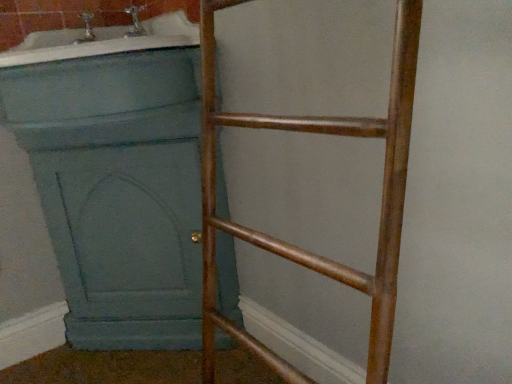
Locate an element on the screen. The width and height of the screenshot is (512, 384). bronze metallic ladder at right is located at coordinates (293, 245).

Where is `matte blue bathtub at upper left`? matte blue bathtub at upper left is located at coordinates (103, 41).

At what (x,y) coordinates should I click in order to perform the action: click on bronze metallic ladder at right. Please return your answer as a coordinate pair (x, y). The width and height of the screenshot is (512, 384). Looking at the image, I should click on coord(293,245).

Is teal painted wood screen door at left far away from matte blue bathtub at upper left?

They are positioned close to each other.

Is teal painted wood screen door at left located outside matte blue bathtub at upper left?

teal painted wood screen door at left lies outside matte blue bathtub at upper left's area.

In order to click on screen door to the right of matte blue bathtub at upper left in this screenshot , I will do `click(126, 242)`.

Measure the distance from teal painted wood screen door at left to matte blue bathtub at upper left.

teal painted wood screen door at left is 15.96 inches away from matte blue bathtub at upper left.

Can you confirm if bronze metallic ladder at right is wider than teal painted wood screen door at left?

In fact, bronze metallic ladder at right might be narrower than teal painted wood screen door at left.

Considering the relative positions of bronze metallic ladder at right and teal painted wood screen door at left in the image provided, is bronze metallic ladder at right to the left or to the right of teal painted wood screen door at left?

bronze metallic ladder at right is positioned on teal painted wood screen door at left's right side.

In the image, is bronze metallic ladder at right positioned in front of or behind teal painted wood screen door at left?

bronze metallic ladder at right is in front of teal painted wood screen door at left.

Consider the image. Is bronze metallic ladder at right positioned with its back to teal painted wood screen door at left?

No, bronze metallic ladder at right is not facing away from teal painted wood screen door at left.

In terms of size, does bronze metallic ladder at right appear bigger or smaller than matte blue bathtub at upper left?

Clearly, bronze metallic ladder at right is larger in size than matte blue bathtub at upper left.

Is bronze metallic ladder at right to the right of matte blue bathtub at upper left from the viewer's perspective?

Correct, you'll find bronze metallic ladder at right to the right of matte blue bathtub at upper left.

Is there a large distance between bronze metallic ladder at right and matte blue bathtub at upper left?

They are positioned close to each other.

From a real-world perspective, is bronze metallic ladder at right below matte blue bathtub at upper left?

Yes, from a real-world perspective, bronze metallic ladder at right is beneath matte blue bathtub at upper left.

From the image's perspective, between matte blue bathtub at upper left and bronze metallic ladder at right, who is located below?

bronze metallic ladder at right, from the image's perspective.

From a real-world perspective, is matte blue bathtub at upper left under bronze metallic ladder at right?

No, from a real-world perspective, matte blue bathtub at upper left is not below bronze metallic ladder at right.

Is matte blue bathtub at upper left not inside bronze metallic ladder at right?

matte blue bathtub at upper left lies outside bronze metallic ladder at right's area.

Which point is more distant from viewer, (48, 42) or (204, 244)?

The point (48, 42) is farther.

Considering the relative positions of matte blue bathtub at upper left and teal painted wood screen door at left in the image provided, is matte blue bathtub at upper left to the left of teal painted wood screen door at left from the viewer's perspective?

Correct, you'll find matte blue bathtub at upper left to the left of teal painted wood screen door at left.

Is matte blue bathtub at upper left thinner than teal painted wood screen door at left?

Incorrect, the width of matte blue bathtub at upper left is not less than that of teal painted wood screen door at left.

Are matte blue bathtub at upper left and teal painted wood screen door at left making contact?

There is a gap between matte blue bathtub at upper left and teal painted wood screen door at left.

Which object is closer to the camera, matte blue bathtub at upper left or teal painted wood screen door at left?

matte blue bathtub at upper left is more forward.

How distant is teal painted wood screen door at left from bronze metallic ladder at right?

teal painted wood screen door at left is 39.16 centimeters from bronze metallic ladder at right.

Considering the sizes of teal painted wood screen door at left and bronze metallic ladder at right in the image, is teal painted wood screen door at left wider or thinner than bronze metallic ladder at right?

teal painted wood screen door at left is wider than bronze metallic ladder at right.

Is teal painted wood screen door at left far away from bronze metallic ladder at right?

teal painted wood screen door at left is near bronze metallic ladder at right, not far away.

Is teal painted wood screen door at left smaller than bronze metallic ladder at right?

No, teal painted wood screen door at left is not smaller than bronze metallic ladder at right.

Identify the location of screen door below the matte blue bathtub at upper left (from a real-world perspective). This screenshot has width=512, height=384. (126, 242).

What are the coordinates of `screen door that appears on the left of bronze metallic ladder at right` in the screenshot? It's located at (126, 242).

Considering their positions, is bronze metallic ladder at right positioned closer to teal painted wood screen door at left than matte blue bathtub at upper left?

bronze metallic ladder at right.

Estimate the real-world distances between objects in this image. Which object is closer to matte blue bathtub at upper left, teal painted wood screen door at left or bronze metallic ladder at right?

Among the two, bronze metallic ladder at right is located nearer to matte blue bathtub at upper left.

Which object lies further to the anchor point bronze metallic ladder at right, matte blue bathtub at upper left or teal painted wood screen door at left?

The object further to bronze metallic ladder at right is teal painted wood screen door at left.

Estimate the real-world distances between objects in this image. Which object is further from matte blue bathtub at upper left, bronze metallic ladder at right or teal painted wood screen door at left?

teal painted wood screen door at left is positioned further to the anchor matte blue bathtub at upper left.

Considering their positions, is matte blue bathtub at upper left positioned closer to teal painted wood screen door at left than bronze metallic ladder at right?

bronze metallic ladder at right.

Estimate the real-world distances between objects in this image. Which object is closer to bronze metallic ladder at right, teal painted wood screen door at left or matte blue bathtub at upper left?

matte blue bathtub at upper left is closer to bronze metallic ladder at right.

This screenshot has height=384, width=512. Find the location of `screen door located between matte blue bathtub at upper left and bronze metallic ladder at right in the left-right direction`. screen door located between matte blue bathtub at upper left and bronze metallic ladder at right in the left-right direction is located at coordinates (126, 242).